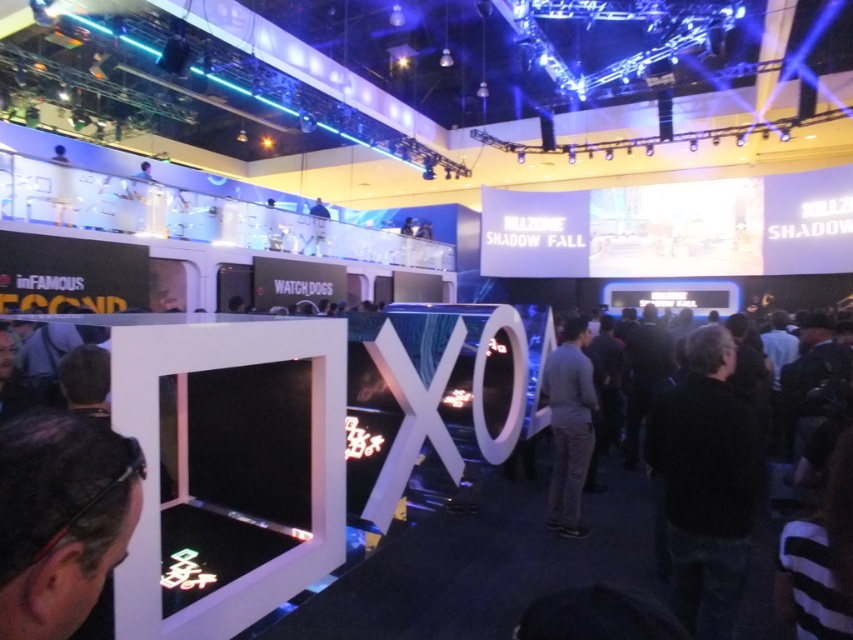
You are standing at the entrance of the gaming event and want to find the black matte jacket at lower right. According to the scene description, where should you look relative to the XO sign?

The black matte jacket at lower right is located at the bottom right corner of the scene, which is to the right side of the XO sign.

You are a photographer at the gaming event. You want to take a photo that includes both the black matte jacket at lower right and the gray fabric shirt at center. Which one should you focus on first to ensure both are in sharp focus?

The black matte jacket at lower right is closer to the viewer than the gray fabric shirt at center. To ensure both are in sharp focus, focus on the black matte jacket at lower right first, as it is closer, and use a smaller aperture or adjust your focus point to cover the distance between them.

You are a photographer at the gaming event. You need to take a photo that includes both the black shirt at center and the gray fabric shirt at center. Which shirt should you adjust to ensure both are fully visible in the frame?

Since the black shirt at center is not as tall as the gray fabric shirt at center, you should lower the camera angle slightly to ensure the entire black shirt at center and the full height of the gray fabric shirt at center are captured in the frame.